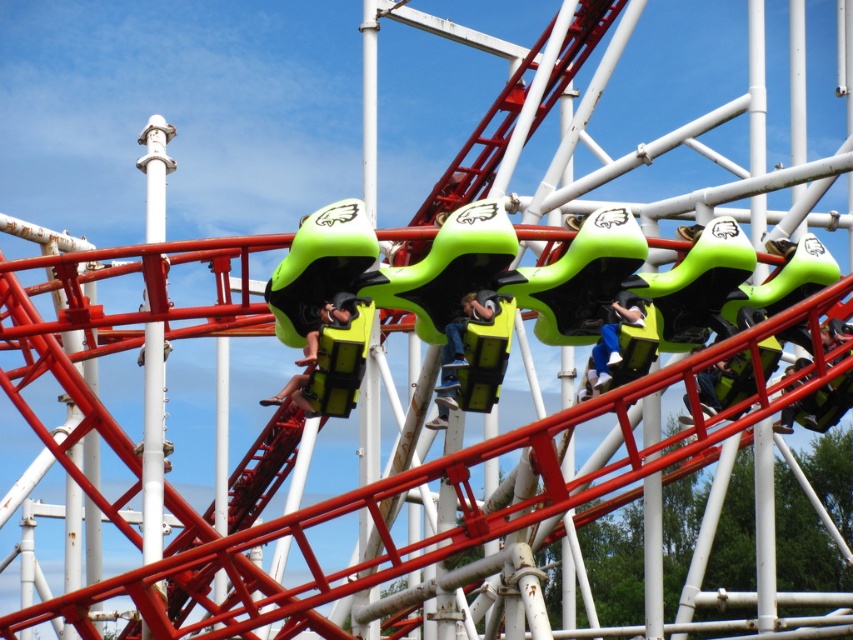
Question: From the image, what is the correct spatial relationship of green matte seat at center in relation to green matte helmet at center?

Choices:
 (A) above
 (B) below

Answer: (A)

Question: Which of the following is the farthest from the observer?

Choices:
 (A) (460, 362)
 (B) (706, 372)

Answer: (B)

Question: Estimate the real-world distances between objects in this image. Which object is farther from the yellow-green fabric safety vest at center?

Choices:
 (A) green matte helmet at center
 (B) yellow-green plastic helmet at center
 (C) light blue fabric pants at center
 (D) green matte seat at center

Answer: (A)

Question: Can you confirm if green matte seat at center is thinner than yellow-green plastic helmet at center?

Choices:
 (A) no
 (B) yes

Answer: (A)

Question: Estimate the real-world distances between objects in this image. Which object is closer to the light blue fabric pants at center?

Choices:
 (A) green matte helmet at center
 (B) yellow-green plastic helmet at center
 (C) yellow-green fabric safety vest at center

Answer: (A)

Question: Can you confirm if yellow-green plastic helmet at center is wider than light blue fabric pants at center?

Choices:
 (A) yes
 (B) no

Answer: (B)